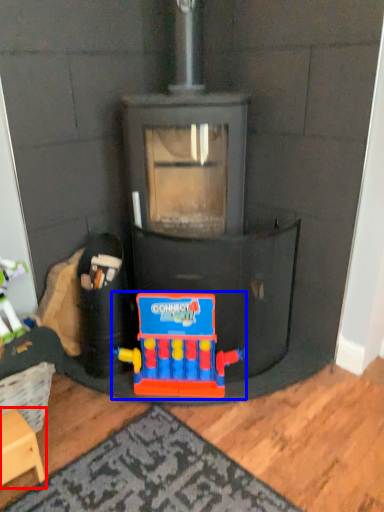
Question: Which object appears closest to the camera in this image, furniture (highlighted by a red box) or toy (highlighted by a blue box)?

Choices:
 (A) furniture
 (B) toy

Answer: (A)